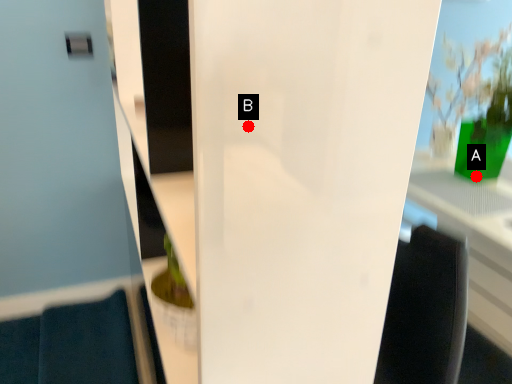
Question: Two points are circled on the image, labeled by A and B beside each circle. Which point is closer to the camera taking this photo?

Choices:
 (A) A is closer
 (B) B is closer

Answer: (B)